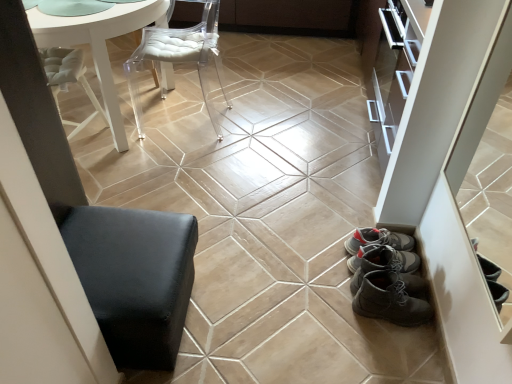
The image size is (512, 384). What are the coordinates of `vacant area that lies between transparent acrylic chair at upper center and black leather ottoman at lower left` in the screenshot? It's located at (181, 180).